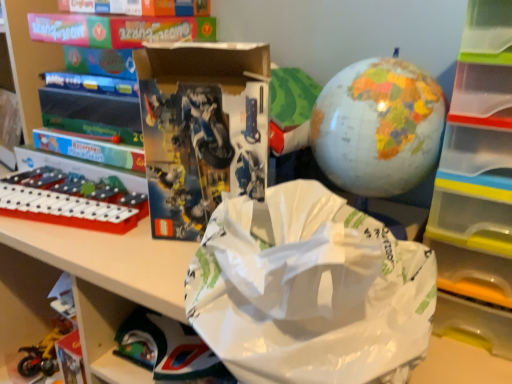
Locate an element on the screen. vacant space in front of white plastic tray at left, which is the second toy in top-to-bottom order is located at coordinates (70, 245).